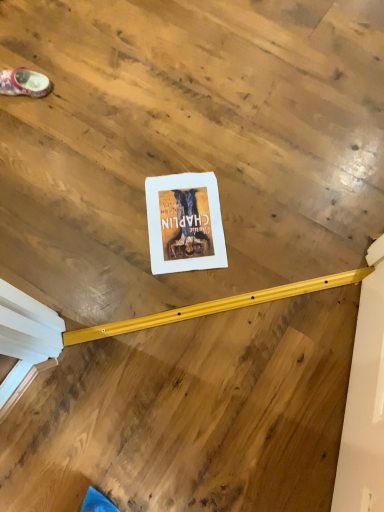
Find the location of a particular element. Image resolution: width=384 pixels, height=512 pixels. unoccupied space behind white paper at center is located at coordinates (183, 147).